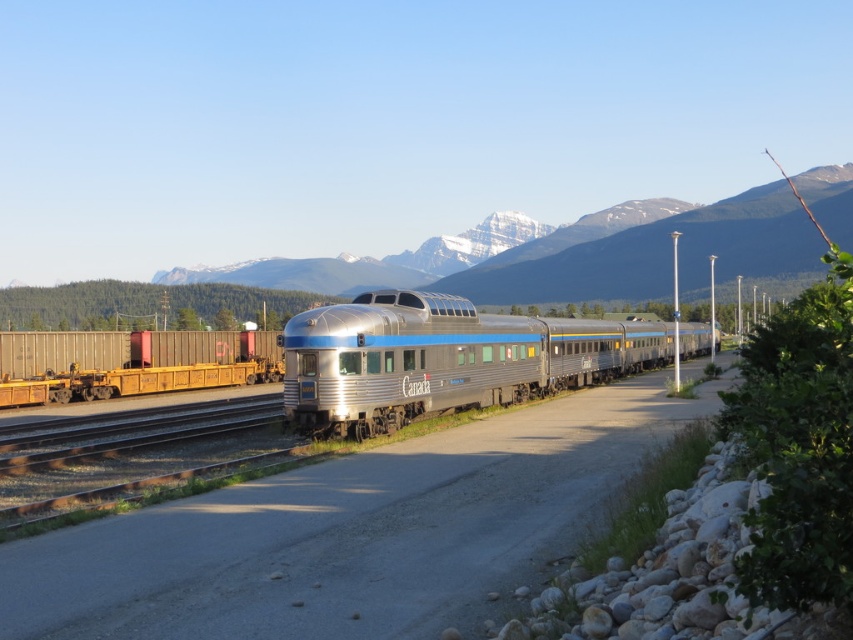
You are a hiker who wants to take a photo of the silver metallic train at center and the snowy mountain at center together in the frame. Your camera can capture a maximum distance of 90 meters between the nearest and farthest objects. Will you be able to include both in a single photo?

The distance between the silver metallic train at center and the snowy mountain at center is 91.01 meters, which exceeds the camera maximum of 90 meters. Therefore, you cannot capture both in a single photo.

You are a photographer standing at the beginning of the pathway. You want to take a photo of both the silver metallic train at center and the snowy mountain at center in the background. Which object should you position closer to the front of your photo?

The silver metallic train at center should be positioned closer to the front of your photo because it is on the right side of the snowy mountain at center, which is further back.

You are standing at the point labeled point (567, 326) and want to walk to point (824, 173). Given that the distance between these two points is 10 meters, and you can only move along the tracks, how far will you have to walk?

Since the distance between point (567, 326) and point (824, 173) is 10 meters, you will have to walk 10 meters along the tracks to reach your destination.